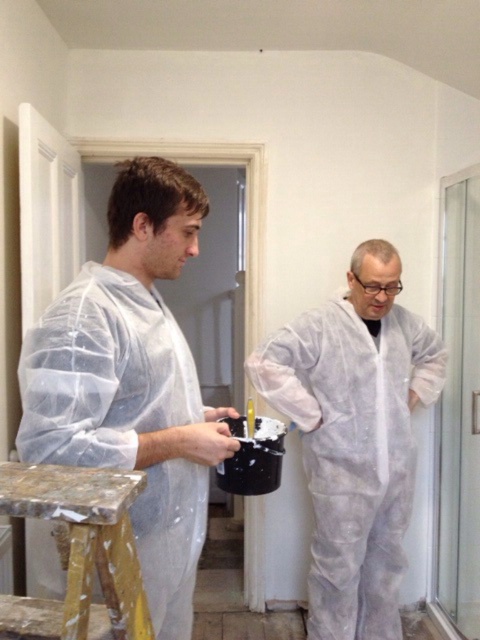
You are trying to decide whether to place a new decorative item between the transparent plastic coat at left and the marbled wood stool at lower left. Based on their sizes, which object should you position closer to the center of the room to ensure there is enough space for the item?

The transparent plastic coat at left might be wider than marbled wood stool at lower left, so positioning the marbled wood stool at lower left closer to the center would leave more space between them for the decorative item.

You are a safety inspector checking the workspace. You notice the transparent plastic coat at left and the white matte coveralls at center. Which item is closer to the entrance of the room?

The transparent plastic coat at left is closer to the entrance of the room because it is in front of the white matte coveralls at center.

You are a painter who needs to place a 10 inch wide tool box between the transparent plastic coat at left and the marbled wood stool at lower left. Can you fit it there?

The transparent plastic coat at left is 9.58 inches away from the marbled wood stool at lower left, so the 10 inch wide tool box cannot fit between them because the distance is less than the tool box width.